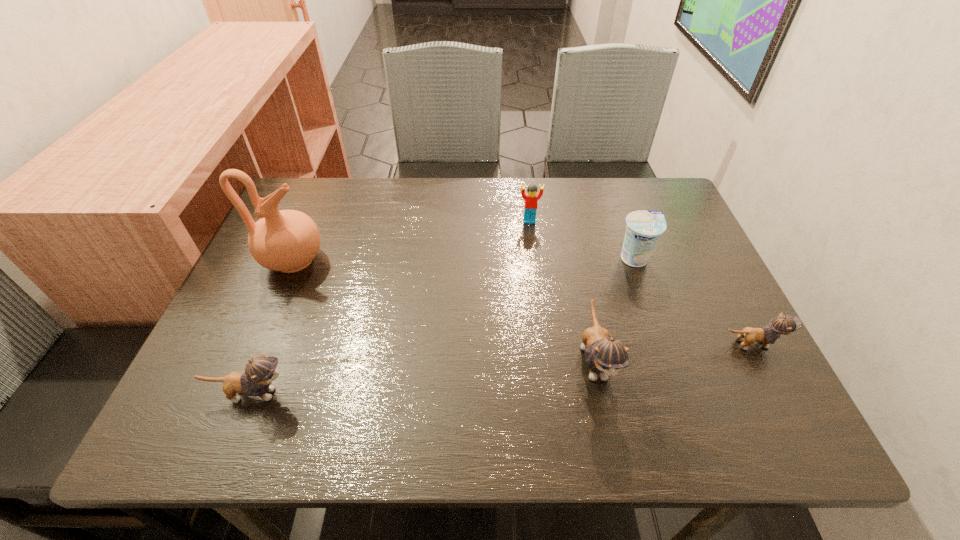
Locate an element on the screen. vacant space at the near edge is located at coordinates coord(449,380).

This screenshot has height=540, width=960. Find the location of `free region at the left edge of the desktop`. free region at the left edge of the desktop is located at coordinates (284, 291).

Locate an element on the screen. The image size is (960, 540). free spot at the right edge of the desktop is located at coordinates (658, 287).

This screenshot has width=960, height=540. In order to click on free region at the far left corner of the desktop in this screenshot , I will do `click(328, 187)`.

Locate an element on the screen. The width and height of the screenshot is (960, 540). vacant space at the far right corner of the desktop is located at coordinates (666, 219).

The image size is (960, 540). What are the coordinates of `unoccupied area between the rightmost kitten and the leftmost kitten` in the screenshot? It's located at (501, 369).

This screenshot has width=960, height=540. Identify the location of vacant region between the second object from right to left and the rightmost kitten. (692, 301).

Find the location of a particular element. The width and height of the screenshot is (960, 540). free space between the rightmost object and the pottery is located at coordinates (522, 302).

In order to click on vacant area between the second kitten from left to right and the farthest object in this screenshot , I will do `click(562, 291)`.

Identify the location of vacant space in between the fifth object from left to right and the rightmost object. The width and height of the screenshot is (960, 540). (692, 301).